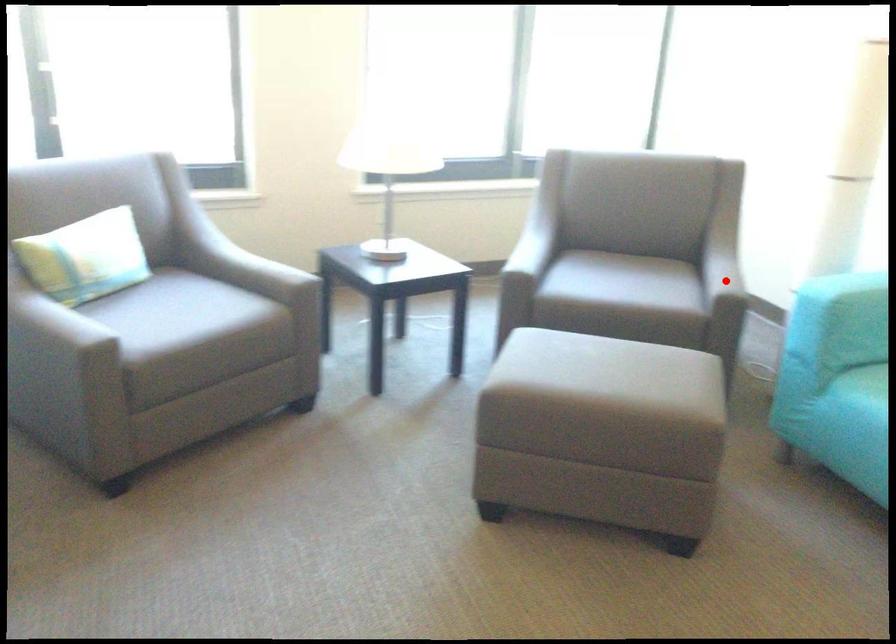
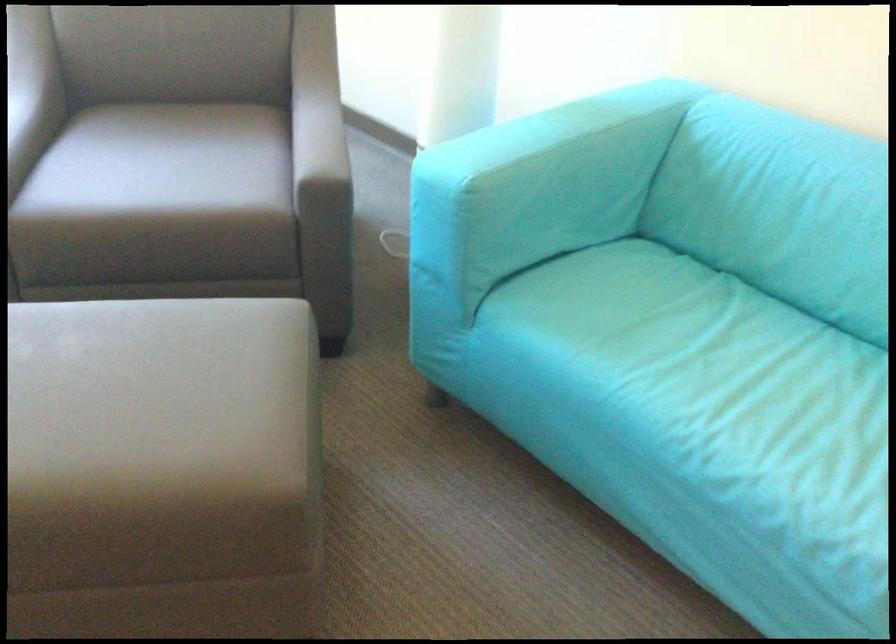
Question: I am providing you with two images of the same scene from different viewpoints. Image1 has a red point marked. In image2, the corresponding 3D location appears at what relative position? Reply with the corresponding letter.

Choices:
 (A) Closer
 (B) Farther

Answer: (A)